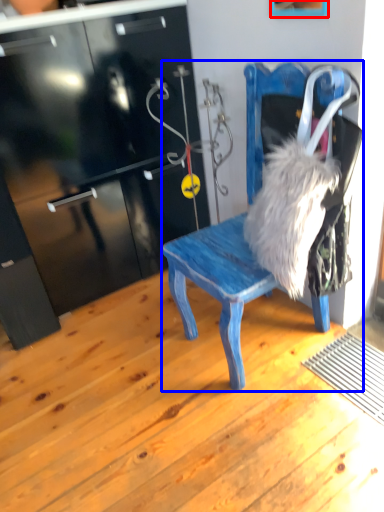
Question: Which point is further to the camera, picture frame (highlighted by a red box) or chair (highlighted by a blue box)?

Choices:
 (A) picture frame
 (B) chair

Answer: (A)